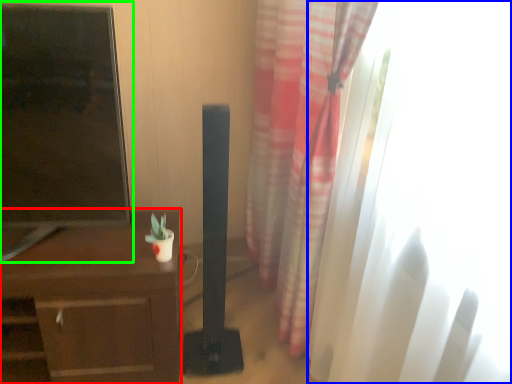
Question: Considering the real-world distances, which object is closest to desk (highlighted by a red box)? window (highlighted by a blue box) or tv show (highlighted by a green box).

Choices:
 (A) window
 (B) tv show

Answer: (B)